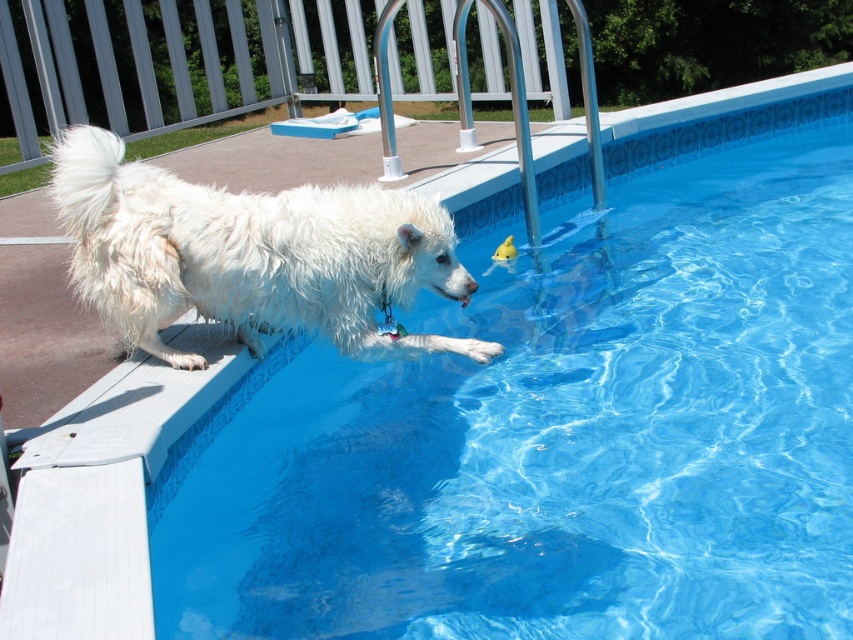
Is blue tile swimming pool at upper center positioned at the back of white fluffy dog at left?

No, it is in front of white fluffy dog at left.

Is point (635, 598) closer to camera compared to point (247, 272)?

Yes, it is in front of point (247, 272).

This screenshot has width=853, height=640. In order to click on blue tile swimming pool at upper center in this screenshot , I will do `click(561, 424)`.